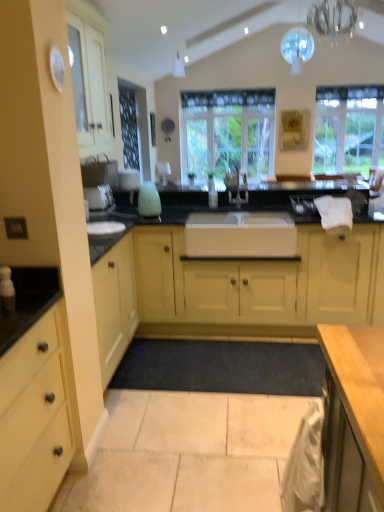
Question: Considering the positions of point (319, 29) and point (44, 499), is point (319, 29) closer or farther from the camera than point (44, 499)?

Choices:
 (A) closer
 (B) farther

Answer: (B)

Question: From the image's perspective, relative to matte yellow cabinet at left, the second cabinetry in the back-to-front sequence, is clear glass chandelier at upper center, marked as the 1th light fixture in a front-to-back arrangement, above or below?

Choices:
 (A) below
 (B) above

Answer: (B)

Question: Estimate the real-world distances between objects in this image. Which object is farther from the clear glass chandelier at upper center, which ranks as the second light fixture in top-to-bottom order?

Choices:
 (A) matte yellow cabinets at center, which appears as the first cabinetry when viewed from the back
 (B) white glossy faucet at center
 (C) clear glass window at upper right, acting as the 2th window starting from the left
 (D) clear glass window at center, which is counted as the 1th window, starting from the left
 (E) transparent glass sphere at upper center, positioned as the second light fixture in front-to-back order

Answer: (A)

Question: Which of these objects is positioned closest to the clear glass chandelier at upper center, marked as the 1th light fixture in a front-to-back arrangement?

Choices:
 (A) matte yellow cabinet at left, the 1th cabinetry when ordered from front to back
 (B) matte yellow cabinets at center, which appears as the first cabinetry when viewed from the back
 (C) dark gray carpet at center
 (D) white glossy faucet at center
 (E) clear glass window at center, which is counted as the 1th window, starting from the left

Answer: (E)